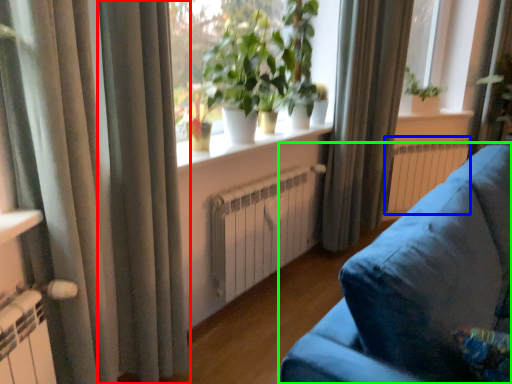
Question: Estimate the real-world distances between objects in this image. Which object is closer to curtain (highlighted by a red box), radiator (highlighted by a blue box) or studio couch (highlighted by a green box)?

Choices:
 (A) radiator
 (B) studio couch

Answer: (B)